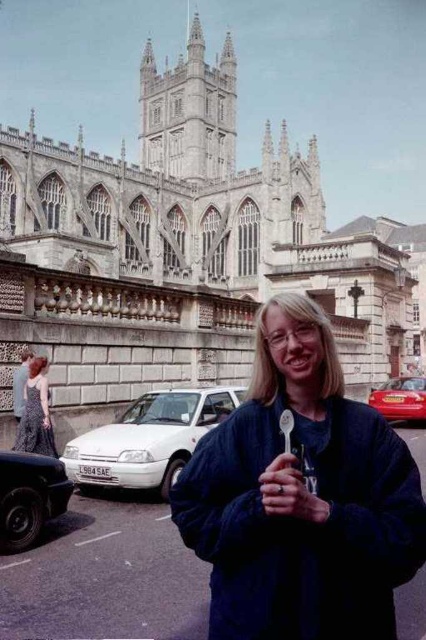
You are a photographer planning to take a picture of the Bath Abbey. You have two cars in the scene, a white matte car at lower left and a shiny red car at center right. Which car is closer to the left side of the frame?

The white matte car at lower left is positioned on the left side of the shiny red car at center right, so it is closer to the left side of the frame.

You are a photographer planning to take a picture of the Bath Abbey. You have two items in your hand, the blue fabric spoon at center and the white matte car at lower left. Which item would you choose to hold up closer to the camera so that both items appear the same size in the photo?

The blue fabric spoon at center is bigger than the white matte car at lower left, so you should hold the white matte car at lower left closer to the camera to make them appear the same size in the photo.

You are planning to take a photo of Bath Abbey with the white matte car at lower left in the frame. Based on its position, where should you position the car relative to the abbey in your composition?

The white matte car at lower left is located at point (149,440), so you should position it at the lower left area of the frame to include it in the photo with Bath Abbey.